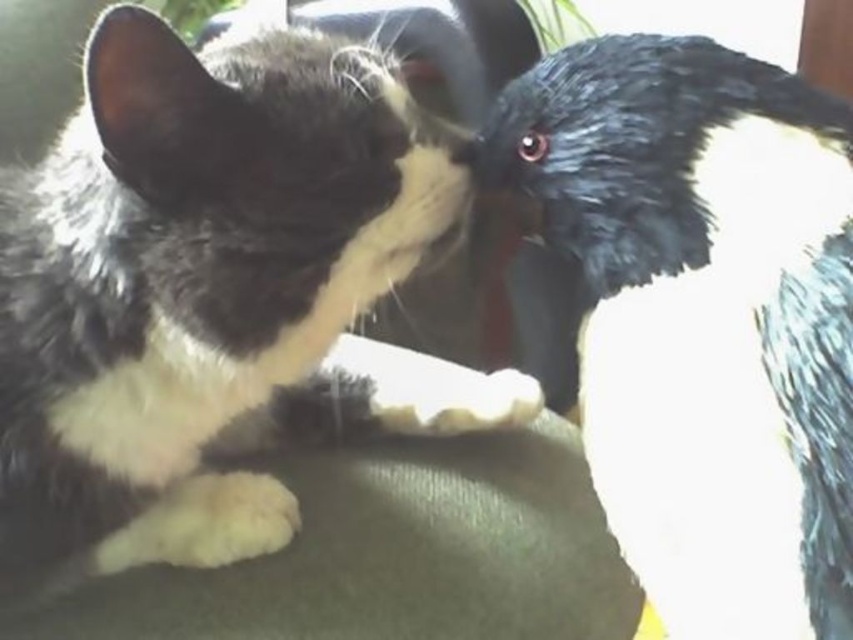
In the scene shown: Which is below, black and white fur cat at center or black fuzzy nose at center?

black and white fur cat at center

Is black and white fur cat at center smaller than black fuzzy nose at center?

Actually, black and white fur cat at center might be larger than black fuzzy nose at center.

Based on the photo, who is more forward, (404, 90) or (460, 160)?

Positioned in front is point (460, 160).

This screenshot has height=640, width=853. Identify the location of black and white fur cat at center. (207, 291).